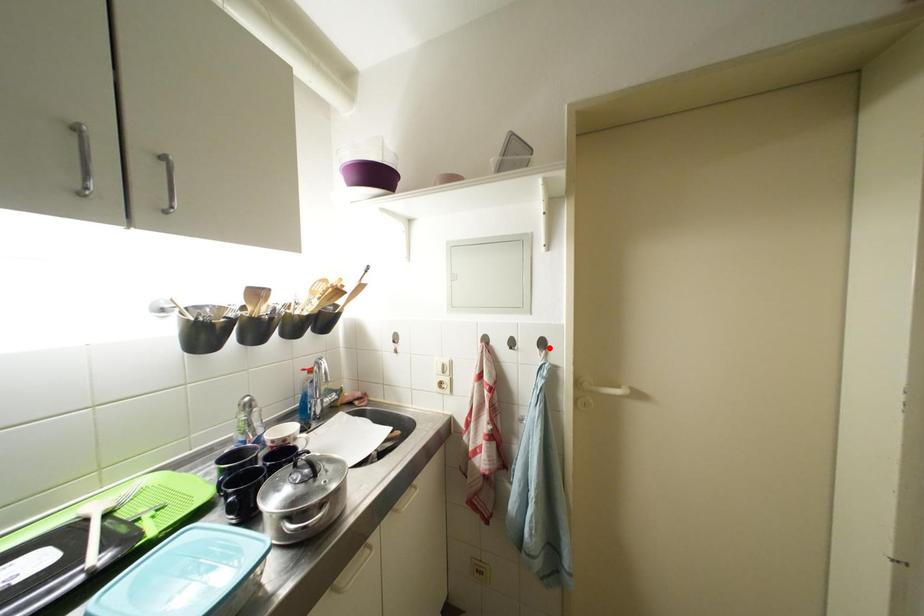
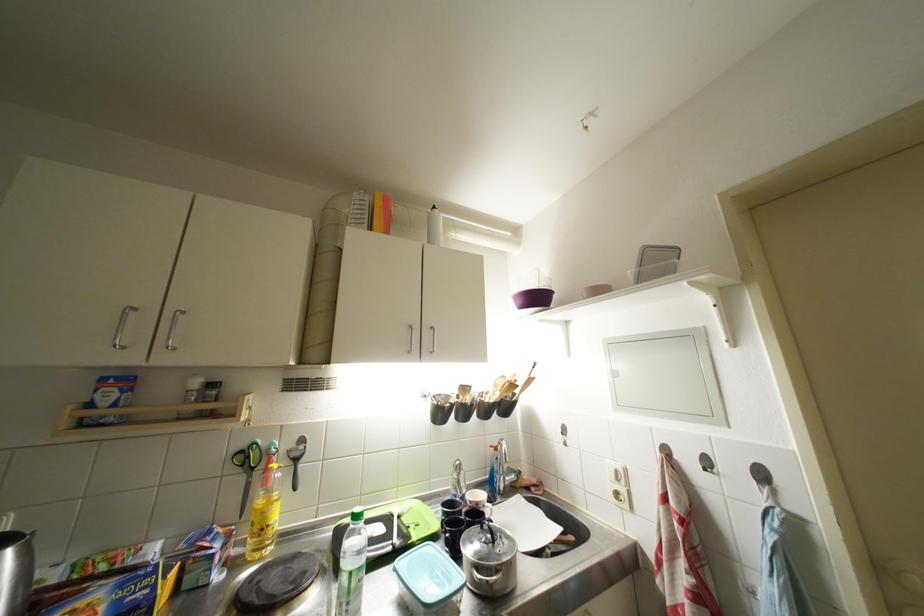
In the second image, find the point that corresponds to the highlighted location in the first image.

(769, 479)